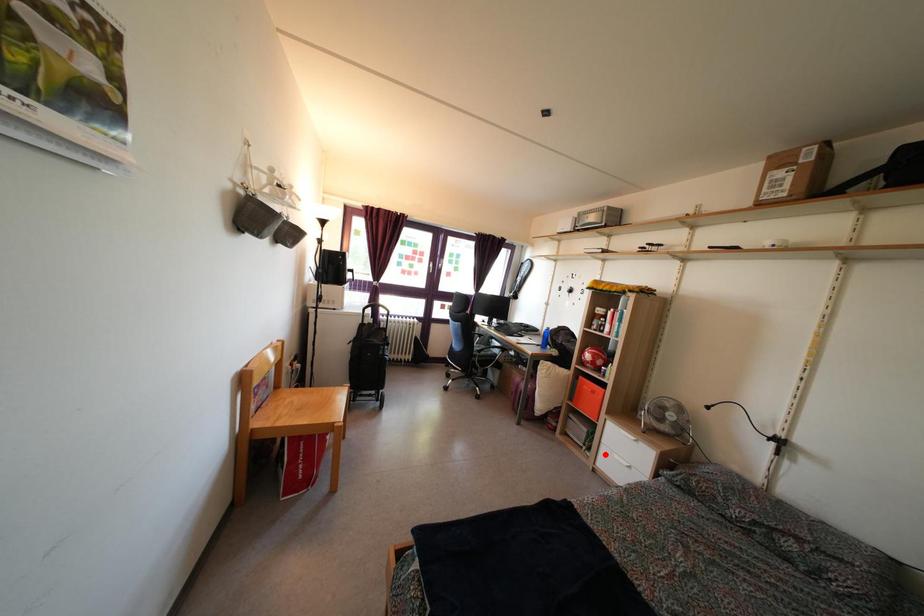
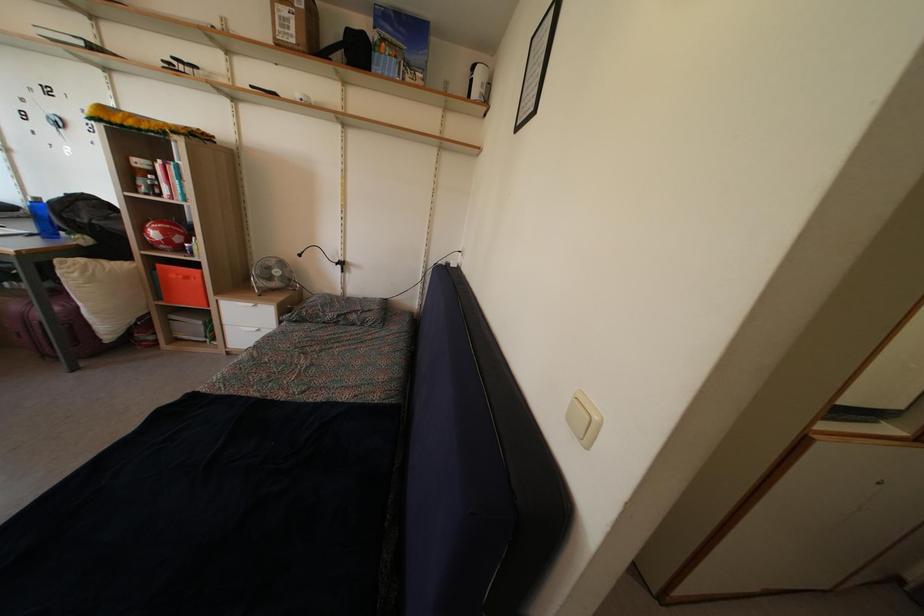
Question: I am providing you with two images of the same scene from different viewpoints. A red point is marked on the first image. Can you still see the location of the red point in image 2?

Choices:
 (A) Yes
 (B) No

Answer: (A)